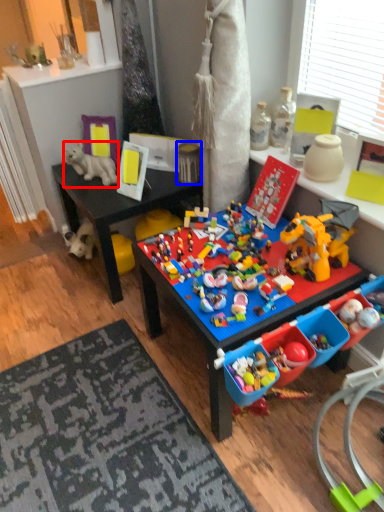
Question: Among these objects, which one is nearest to the camera, toy (highlighted by a red box) or toy (highlighted by a blue box)?

Choices:
 (A) toy
 (B) toy

Answer: (B)